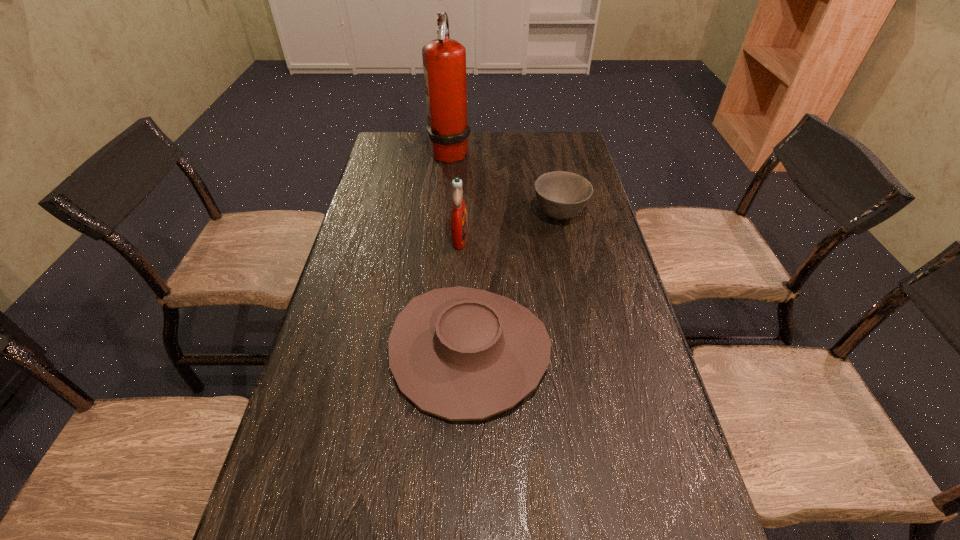
Locate an element on the screen. This screenshot has height=540, width=960. fire extinguisher is located at coordinates (444, 60).

Locate an element on the screen. The width and height of the screenshot is (960, 540). the tallest object is located at coordinates tap(444, 60).

Identify the location of detergent. The image size is (960, 540). (458, 216).

Locate an element on the screen. The image size is (960, 540). the rightmost object is located at coordinates (561, 195).

Where is `the nearest object`? the nearest object is located at coordinates (459, 353).

Locate an element on the screen. Image resolution: width=960 pixels, height=540 pixels. free space located 0.320m at the nozzle of the fire extinguisher is located at coordinates (556, 151).

Image resolution: width=960 pixels, height=540 pixels. In order to click on free point located 0.150m on the front surface of the detergent in this screenshot , I will do `click(519, 238)`.

Where is `vacant space located on the back of the rightmost object`? Image resolution: width=960 pixels, height=540 pixels. vacant space located on the back of the rightmost object is located at coordinates (554, 186).

Locate an element on the screen. The height and width of the screenshot is (540, 960). free space located on the back of the nearest object is located at coordinates (471, 279).

The height and width of the screenshot is (540, 960). What are the coordinates of `object that is at the far edge` in the screenshot? It's located at (444, 60).